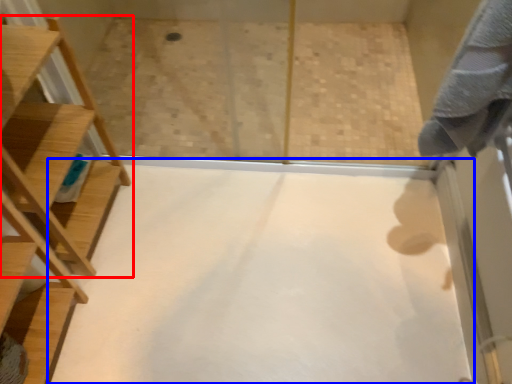
Question: Which object appears closest to the camera in this image, furniture (highlighted by a red box) or plain (highlighted by a blue box)?

Choices:
 (A) furniture
 (B) plain

Answer: (A)